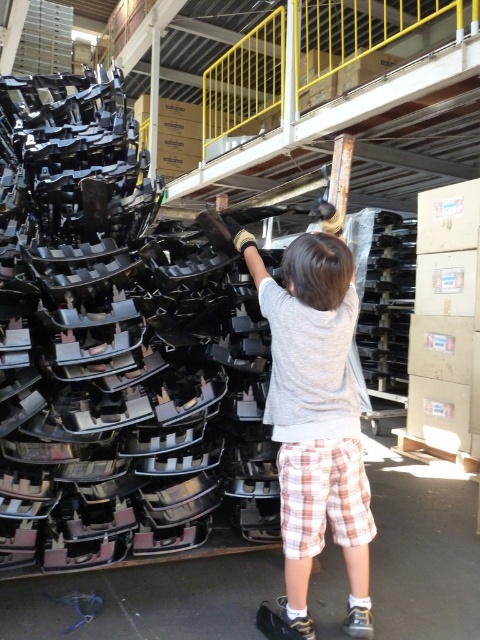
Question: Which object appears closest to the camera in this image?

Choices:
 (A) white fabric shoe at lower center
 (B) white textured shoe at lower center

Answer: (A)

Question: Estimate the real-world distances between objects in this image. Which object is farther from the white textured shoe at lower center?

Choices:
 (A) white cotton shirt at center
 (B) matte black shoe at center

Answer: (B)

Question: Observing the image, what is the correct spatial positioning of white cotton shirt at center in reference to matte black shoe at center?

Choices:
 (A) left
 (B) right

Answer: (B)

Question: Which point is closer to the camera?

Choices:
 (A) white fabric shoe at lower center
 (B) matte black shoe at center
 (C) white textured shoe at lower center

Answer: (A)

Question: Is white cotton shirt at center above white fabric shoe at lower center?

Choices:
 (A) no
 (B) yes

Answer: (B)

Question: Does white cotton shirt at center appear on the right side of white textured shoe at lower center?

Choices:
 (A) yes
 (B) no

Answer: (B)